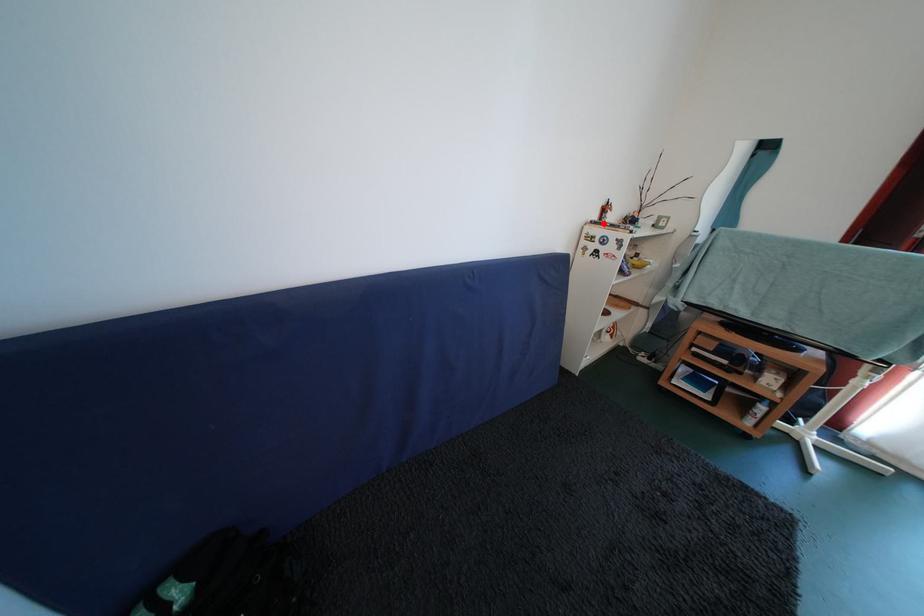
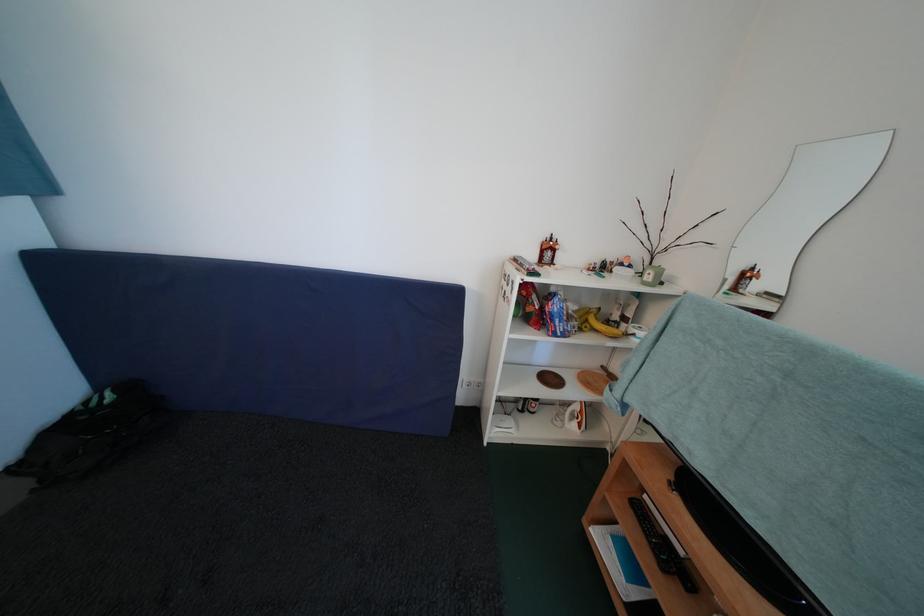
The point at the highlighted location is marked in the first image. Where is the corresponding point in the second image?

(539, 261)